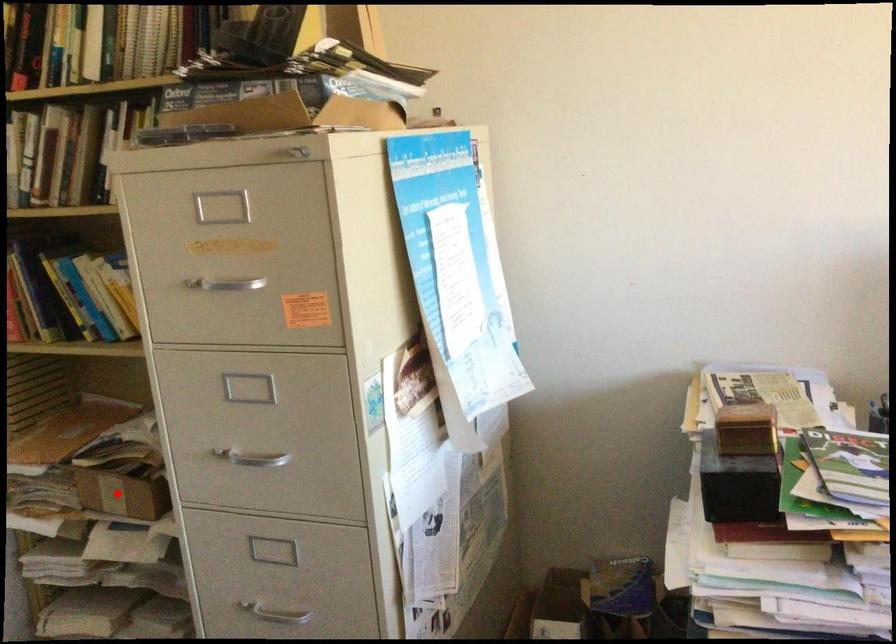
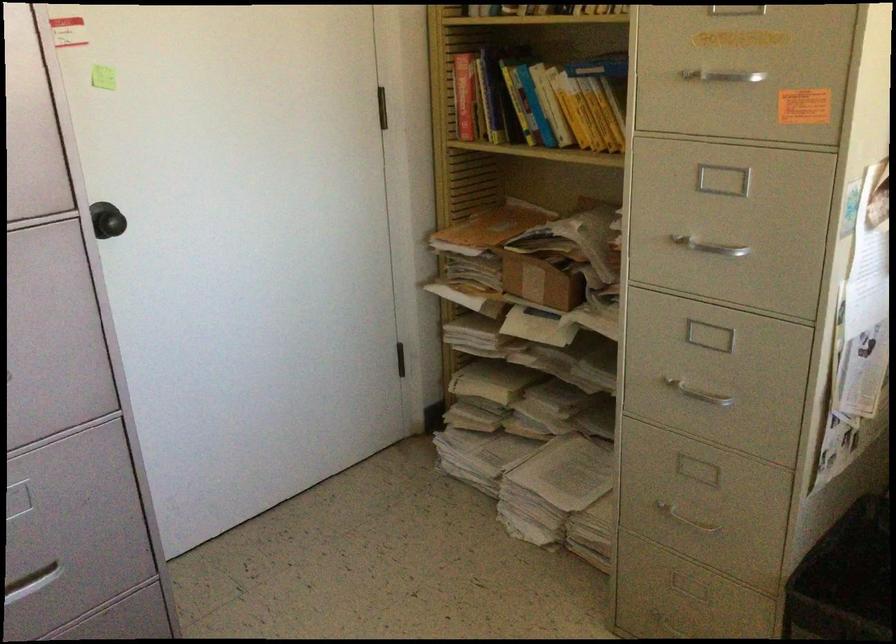
Question: A red point is marked in image1. In image2, is the corresponding 3D point closer to the camera or farther? Reply with the corresponding letter.

Choices:
 (A) The corresponding 3D point is closer.
 (B) The corresponding 3D point is farther.

Answer: (B)